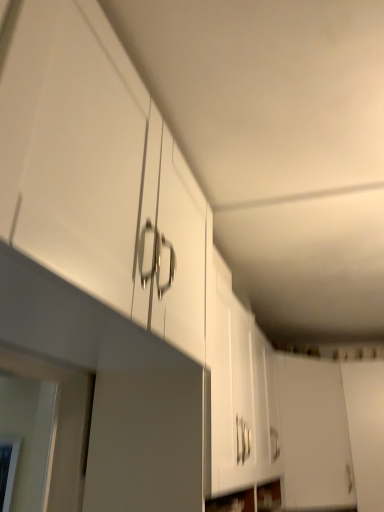
Question: Is white glossy cabinet at upper left smaller than white matte door at lower right, acting as the 2th door starting from the left?

Choices:
 (A) no
 (B) yes

Answer: (A)

Question: Is white glossy cabinet at upper left outside of white matte door at lower right, arranged as the first door when viewed from the right?

Choices:
 (A) yes
 (B) no

Answer: (A)

Question: From the image's perspective, does white glossy cabinet at upper left appear lower than white matte door at lower right, arranged as the first door when viewed from the right?

Choices:
 (A) no
 (B) yes

Answer: (A)

Question: Are white glossy cabinet at upper left and white matte door at lower right, arranged as the first door when viewed from the right, located far from each other?

Choices:
 (A) no
 (B) yes

Answer: (B)

Question: Considering the relative sizes of white glossy cabinet at upper left and white matte door at lower right, acting as the 2th door starting from the left, in the image provided, is white glossy cabinet at upper left bigger than white matte door at lower right, acting as the 2th door starting from the left,?

Choices:
 (A) yes
 (B) no

Answer: (A)

Question: From the image's perspective, is white matte cabinet door at lower right, the first door positioned from the left, positioned above or below white glossy cabinet at upper left?

Choices:
 (A) above
 (B) below

Answer: (B)

Question: From a real-world perspective, is white matte cabinet door at lower right, positioned as the 2th door in right-to-left order, physically located above or below white glossy cabinet at upper left?

Choices:
 (A) below
 (B) above

Answer: (A)

Question: In terms of width, does white matte cabinet door at lower right, the first door positioned from the left, look wider or thinner when compared to white glossy cabinet at upper left?

Choices:
 (A) wide
 (B) thin

Answer: (B)

Question: Considering their positions, is white matte cabinet door at lower right, the first door positioned from the left, located in front of or behind white glossy cabinet at upper left?

Choices:
 (A) behind
 (B) front

Answer: (A)

Question: Is white matte cabinet door at lower right, the first door positioned from the left, taller or shorter than white matte door at lower right, acting as the 2th door starting from the left?

Choices:
 (A) tall
 (B) short

Answer: (B)

Question: Looking at their shapes, would you say white matte cabinet door at lower right, positioned as the 2th door in right-to-left order, is wider or thinner than white matte door at lower right, arranged as the first door when viewed from the right?

Choices:
 (A) wide
 (B) thin

Answer: (A)

Question: Considering the positions of point (299, 431) and point (360, 416), is point (299, 431) closer or farther from the camera than point (360, 416)?

Choices:
 (A) closer
 (B) farther

Answer: (A)

Question: Choose the correct answer: Is white matte cabinet door at lower right, positioned as the 2th door in right-to-left order, inside white matte door at lower right, acting as the 2th door starting from the left, or outside it?

Choices:
 (A) outside
 (B) inside

Answer: (A)

Question: From a real-world perspective, is white matte door at lower right, arranged as the first door when viewed from the right, physically located above or below white matte cabinet door at lower right, positioned as the 2th door in right-to-left order?

Choices:
 (A) above
 (B) below

Answer: (B)

Question: From the image's perspective, is white matte door at lower right, arranged as the first door when viewed from the right, positioned above or below white matte cabinet door at lower right, the first door positioned from the left?

Choices:
 (A) above
 (B) below

Answer: (B)